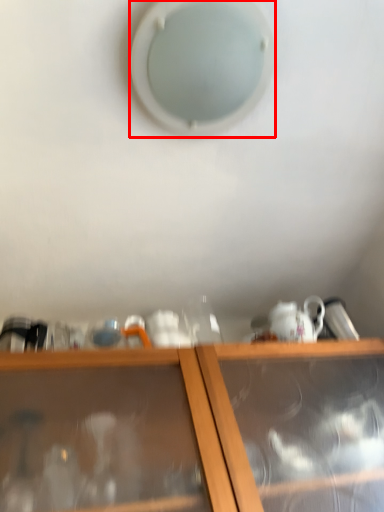
Question: From the image's perspective, what is the correct spatial positioning of hole (annotated by the red box) in reference to shelf?

Choices:
 (A) above
 (B) below

Answer: (A)